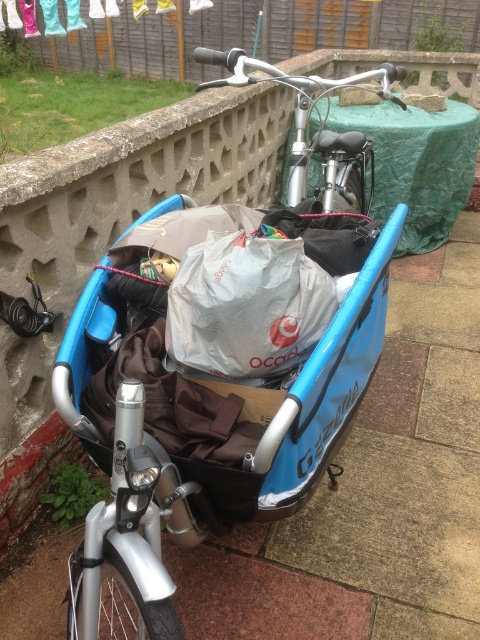
Question: Which object is farther from the camera taking this photo?

Choices:
 (A) silver metallic bicycle at upper center
 (B) blue matte cargo bike at center

Answer: (A)

Question: Does blue matte cargo bike at center appear under silver metallic bicycle at upper center?

Choices:
 (A) yes
 (B) no

Answer: (A)

Question: Observing the image, what is the correct spatial positioning of blue matte cargo bike at center in reference to silver metallic bicycle at upper center?

Choices:
 (A) above
 (B) below

Answer: (B)

Question: Among these points, which one is farthest from the camera?

Choices:
 (A) (328, 173)
 (B) (213, 518)

Answer: (A)

Question: Is blue matte cargo bike at center below silver metallic bicycle at upper center?

Choices:
 (A) no
 (B) yes

Answer: (B)